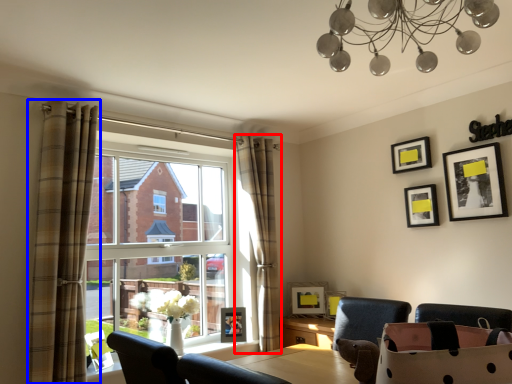
Question: Which point is further to the camera, curtain (highlighted by a red box) or curtain (highlighted by a blue box)?

Choices:
 (A) curtain
 (B) curtain

Answer: (A)